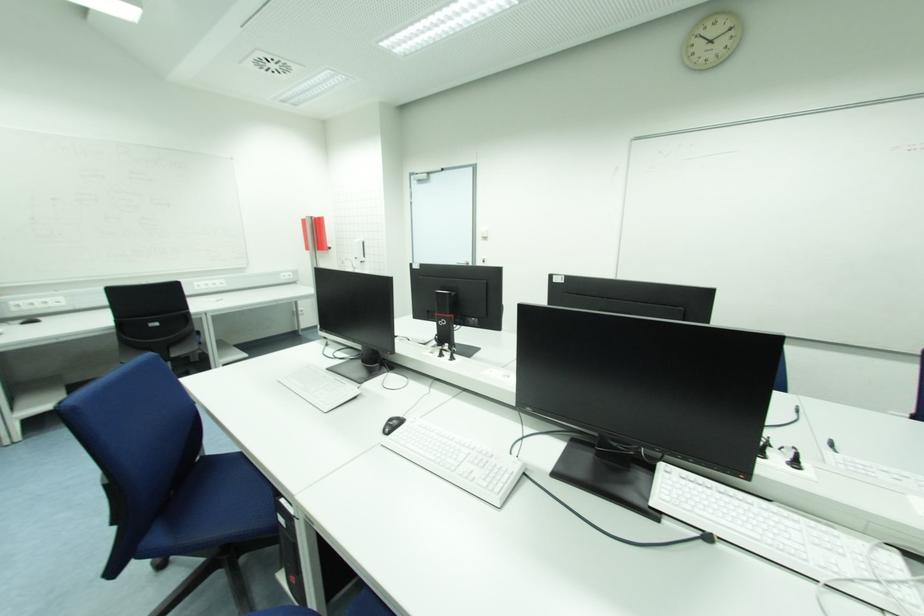
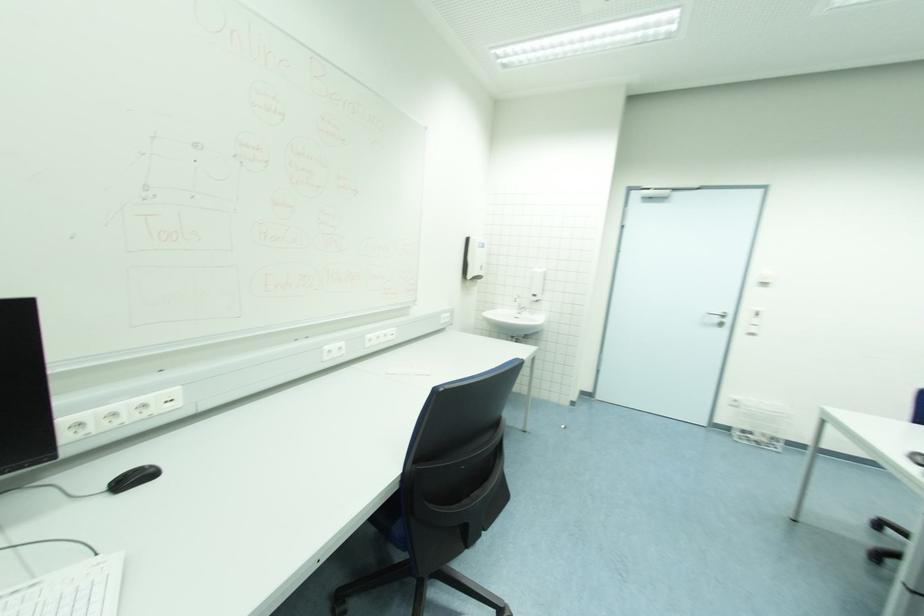
Consider the image. In a continuous first-person perspective shot, in which direction is the camera moving?

The movement direction of the cameraman is left, forward.